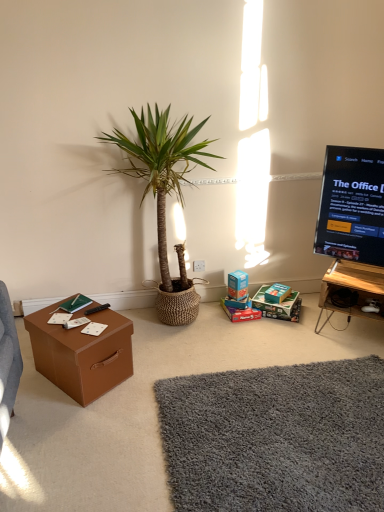
Question: Would you consider teal cardboard box at center, marked as the 2th storage box in a right-to-left arrangement, to be distant from shaggy gray rug at lower center, placed as the 2th plain when sorted from front to back?

Choices:
 (A) yes
 (B) no

Answer: (A)

Question: Could you tell me if teal cardboard box at center, the 2th storage box viewed from the left, is turned towards shaggy gray rug at lower center, placed as the 2th plain when sorted from front to back?

Choices:
 (A) no
 (B) yes

Answer: (B)

Question: From the image's perspective, is teal cardboard box at center, marked as the 2th storage box in a right-to-left arrangement, below shaggy gray rug at lower center, placed as the 2th plain when sorted from front to back?

Choices:
 (A) no
 (B) yes

Answer: (A)

Question: Can you confirm if teal cardboard box at center, marked as the 2th storage box in a right-to-left arrangement, is smaller than shaggy gray rug at lower center, which is the first plain in back-to-front order?

Choices:
 (A) yes
 (B) no

Answer: (A)

Question: Is teal cardboard box at center, marked as the 2th storage box in a right-to-left arrangement, thinner than shaggy gray rug at lower center, which is the first plain in back-to-front order?

Choices:
 (A) yes
 (B) no

Answer: (A)

Question: Is matte brown cardboard box at center inside or outside of brown cardboard box at lower left?

Choices:
 (A) inside
 (B) outside

Answer: (B)

Question: Based on their sizes in the image, would you say matte brown cardboard box at center is bigger or smaller than brown cardboard box at lower left?

Choices:
 (A) big
 (B) small

Answer: (B)

Question: Does point (228, 288) appear closer or farther from the camera than point (99, 388)?

Choices:
 (A) closer
 (B) farther

Answer: (B)

Question: In terms of height, does matte brown cardboard box at center look taller or shorter compared to brown cardboard box at lower left?

Choices:
 (A) short
 (B) tall

Answer: (A)

Question: Is brown cardboard box at lower left to the left or to the right of matte cardboard box at lower center, which ranks as the 3th storage box in right-to-left order, in the image?

Choices:
 (A) right
 (B) left

Answer: (B)

Question: Looking at the image, does brown cardboard box at lower left seem bigger or smaller compared to matte cardboard box at lower center, which ranks as the 3th storage box in right-to-left order?

Choices:
 (A) small
 (B) big

Answer: (B)

Question: From their relative heights in the image, would you say brown cardboard box at lower left is taller or shorter than matte cardboard box at lower center, which ranks as the 3th storage box in right-to-left order?

Choices:
 (A) tall
 (B) short

Answer: (A)

Question: From a real-world perspective, relative to matte cardboard box at lower center, which ranks as the 3th storage box in right-to-left order, is brown cardboard box at lower left vertically above or below?

Choices:
 (A) above
 (B) below

Answer: (A)

Question: From the image's perspective, is white plastic power outlet at center above or below black glossy screen at upper right?

Choices:
 (A) below
 (B) above

Answer: (A)

Question: Considering the relative positions of white plastic power outlet at center and black glossy screen at upper right in the image provided, is white plastic power outlet at center to the left or to the right of black glossy screen at upper right?

Choices:
 (A) left
 (B) right

Answer: (A)